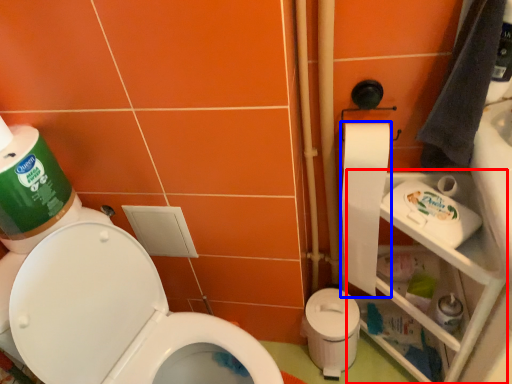
Question: Which object is further to the camera taking this photo, shelf (highlighted by a red box) or toilet paper (highlighted by a blue box)?

Choices:
 (A) shelf
 (B) toilet paper

Answer: (B)